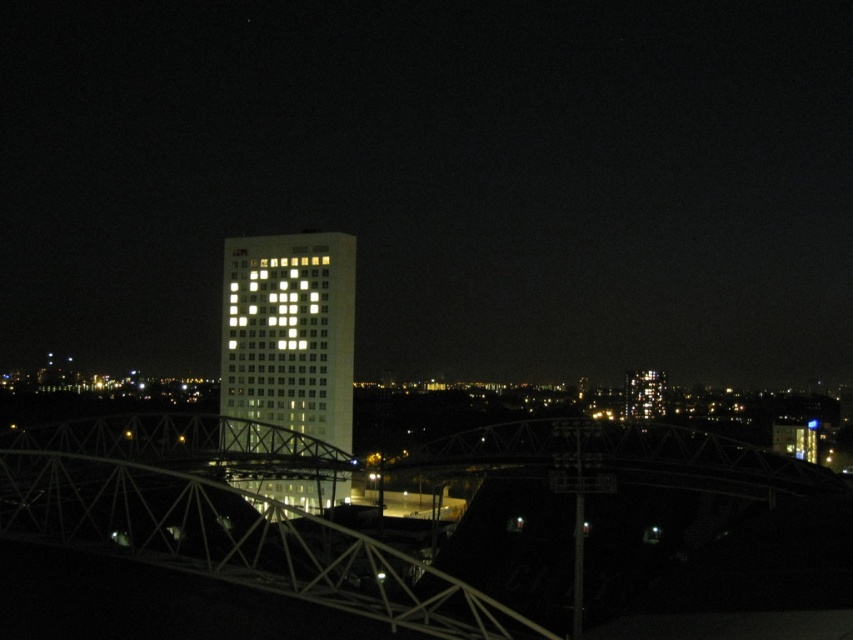
Does white metallic bridge at center appear under white illuminated building at center?

Indeed, white metallic bridge at center is positioned under white illuminated building at center.

Who is more forward, (231, 570) or (259, 312)?

Point (231, 570) is in front.

I want to click on white metallic bridge at center, so click(224, 516).